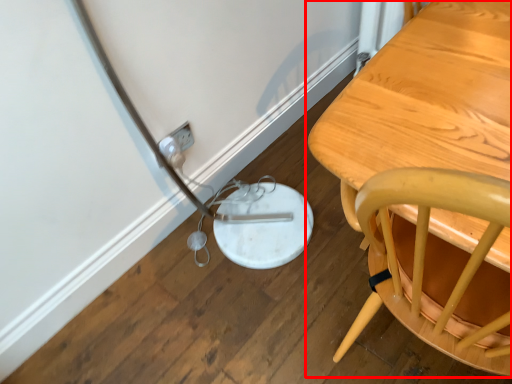
Question: From the image, what is the correct spatial relationship of table (annotated by the red box) in relation to electric outlet?

Choices:
 (A) left
 (B) right

Answer: (B)